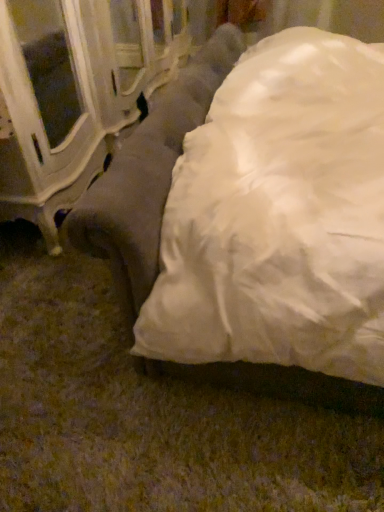
Find the location of `suede-like gray couch at center`. suede-like gray couch at center is located at coordinates click(110, 234).

What do you see at coordinates (110, 234) in the screenshot? I see `suede-like gray couch at center` at bounding box center [110, 234].

Measure the distance between white glossy cabinet at left and camera.

1.16 meters.

Image resolution: width=384 pixels, height=512 pixels. Identify the location of white glossy cabinet at left. (45, 134).

What do you see at coordinates (45, 134) in the screenshot?
I see `white glossy cabinet at left` at bounding box center [45, 134].

The image size is (384, 512). What are the coordinates of `suede-like gray couch at center` in the screenshot? It's located at (110, 234).

Considering the relative positions of white glossy cabinet at left and suede-like gray couch at center in the image provided, is white glossy cabinet at left to the right of suede-like gray couch at center from the viewer's perspective?

No.

Which object is further away from the camera taking this photo, white glossy cabinet at left or suede-like gray couch at center?

white glossy cabinet at left is further from the camera.

Which is less distant, (x=70, y=197) or (x=113, y=231)?

Point (x=70, y=197) is farther from the camera than point (x=113, y=231).

Based on the photo, from the image's perspective, does white glossy cabinet at left appear lower than suede-like gray couch at center?

Incorrect, from the image's perspective, white glossy cabinet at left is higher than suede-like gray couch at center.

From a real-world perspective, is white glossy cabinet at left below suede-like gray couch at center?

Yes, from a real-world perspective, white glossy cabinet at left is beneath suede-like gray couch at center.

Does white glossy cabinet at left have a greater width compared to suede-like gray couch at center?

Incorrect, the width of white glossy cabinet at left does not surpass that of suede-like gray couch at center.

Considering the sizes of objects white glossy cabinet at left and suede-like gray couch at center in the image provided, who is shorter, white glossy cabinet at left or suede-like gray couch at center?

Standing shorter between the two is white glossy cabinet at left.

Considering the relative sizes of white glossy cabinet at left and suede-like gray couch at center in the image provided, is white glossy cabinet at left smaller than suede-like gray couch at center?

Yes.

Is white glossy cabinet at left situated inside suede-like gray couch at center or outside?

white glossy cabinet at left lies outside suede-like gray couch at center.

Are white glossy cabinet at left and suede-like gray couch at center beside each other?

white glossy cabinet at left is not next to suede-like gray couch at center, and they're not touching.

Is white glossy cabinet at left oriented away from suede-like gray couch at center?

No, white glossy cabinet at left's orientation is not away from suede-like gray couch at center.

How different are the orientations of white glossy cabinet at left and suede-like gray couch at center in degrees?

The facing directions of white glossy cabinet at left and suede-like gray couch at center are 179 degrees apart.

Where is `studio couch below the white glossy cabinet at left (from the image's perspective)`? The image size is (384, 512). studio couch below the white glossy cabinet at left (from the image's perspective) is located at coordinates (110, 234).

Between suede-like gray couch at center and white glossy cabinet at left, which one appears on the right side from the viewer's perspective?

suede-like gray couch at center.

Considering their positions, is suede-like gray couch at center located in front of or behind white glossy cabinet at left?

In the image, suede-like gray couch at center appears in front of white glossy cabinet at left.

Is point (78, 234) more distant than point (80, 14)?

No, (78, 234) is in front of (80, 14).

From the image's perspective, is suede-like gray couch at center over white glossy cabinet at left?

Actually, suede-like gray couch at center appears below white glossy cabinet at left in the image.

From a real-world perspective, between suede-like gray couch at center and white glossy cabinet at left, who is vertically lower?

In real-world perspective, white glossy cabinet at left is lower.

Does suede-like gray couch at center have a lesser width compared to white glossy cabinet at left?

No.

Who is taller, suede-like gray couch at center or white glossy cabinet at left?

With more height is suede-like gray couch at center.

Between suede-like gray couch at center and white glossy cabinet at left, which one has larger size?

Bigger between the two is suede-like gray couch at center.

Choose the correct answer: Is suede-like gray couch at center inside white glossy cabinet at left or outside it?

suede-like gray couch at center is not inside white glossy cabinet at left, it's outside.

Can you see suede-like gray couch at center touching white glossy cabinet at left?

No, suede-like gray couch at center is not in contact with white glossy cabinet at left.

Could you tell me if suede-like gray couch at center is turned towards white glossy cabinet at left?

Yes, suede-like gray couch at center is aimed at white glossy cabinet at left.

Consider the image. How many degrees apart are the facing directions of suede-like gray couch at center and white glossy cabinet at left?

179 degrees.

Measure the distance between suede-like gray couch at center and white glossy cabinet at left.

suede-like gray couch at center and white glossy cabinet at left are 66.52 centimeters apart.

You are a GUI agent. You are given a task and a screenshot of the screen. Output one action in this format:
    pyautogui.click(x=<x>, y=<y>)
    Task: Click on the furniture below the suede-like gray couch at center (from a real-world perspective)
    
    Given the screenshot: What is the action you would take?
    pyautogui.click(x=45, y=134)

Where is `furniture behind the suede-like gray couch at center`? This screenshot has height=512, width=384. furniture behind the suede-like gray couch at center is located at coordinates (45, 134).

Identify the location of studio couch above the white glossy cabinet at left (from a real-world perspective). This screenshot has height=512, width=384. (110, 234).